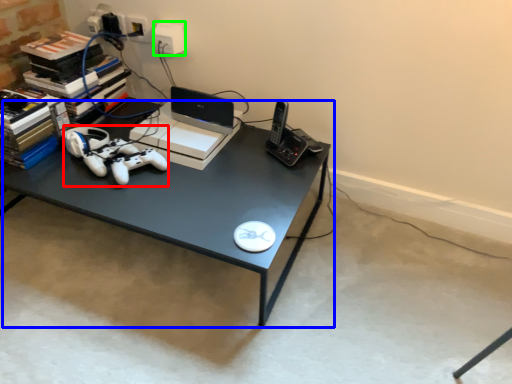
Question: Which object is the farthest from game controller (highlighted by a red box)? Choose among these: desk (highlighted by a blue box) or electric outlet (highlighted by a green box).

Choices:
 (A) desk
 (B) electric outlet

Answer: (B)